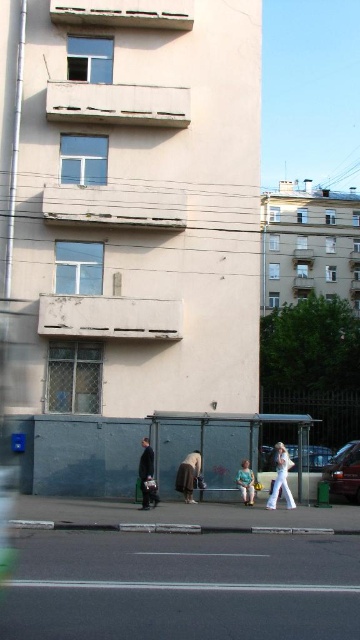
Question: Which object is farther from the camera taking this photo?

Choices:
 (A) metallic silver bus stop at center
 (B) light blue denim jeans at lower center
 (C) white cotton pants at lower center

Answer: (A)

Question: Observing the image, what is the correct spatial positioning of shiny black car at lower right in reference to white cotton pants at lower center?

Choices:
 (A) below
 (B) above

Answer: (A)

Question: Is metallic silver bus stop at center further to camera compared to metallic silver car at center?

Choices:
 (A) yes
 (B) no

Answer: (A)

Question: Which point appears closest to the camera in this image?

Choices:
 (A) (285, 481)
 (B) (354, 496)
 (C) (244, 490)

Answer: (A)

Question: Is white cotton pants at lower center closer to the viewer compared to brown fabric skirt at center?

Choices:
 (A) no
 (B) yes

Answer: (B)

Question: Which of the following is the closest to the observer?

Choices:
 (A) (146, 474)
 (B) (315, 460)
 (C) (273, 467)
 (D) (330, 483)

Answer: (A)